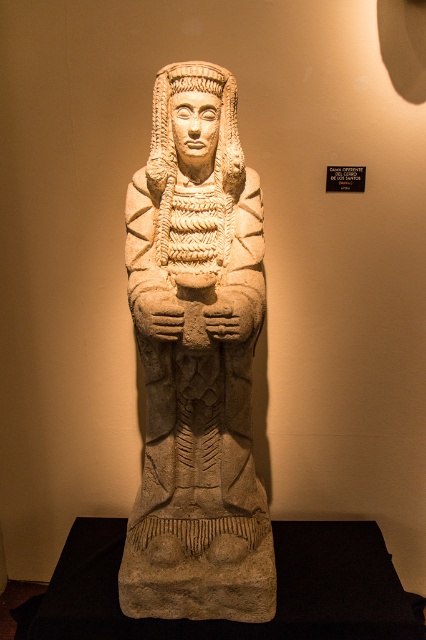
Question: Is beige stone statue at center below beige stone headdress at center?

Choices:
 (A) yes
 (B) no

Answer: (A)

Question: Does beige stone statue at center appear over beige stone headdress at center?

Choices:
 (A) no
 (B) yes

Answer: (A)

Question: Is the position of beige stone statue at center more distant than that of beige stone headdress at center?

Choices:
 (A) no
 (B) yes

Answer: (A)

Question: Which of the following is the farthest from the observer?

Choices:
 (A) beige stone headdress at center
 (B) beige stone statue at center

Answer: (A)

Question: Which point is farther to the camera?

Choices:
 (A) beige stone headdress at center
 (B) beige stone statue at center

Answer: (A)